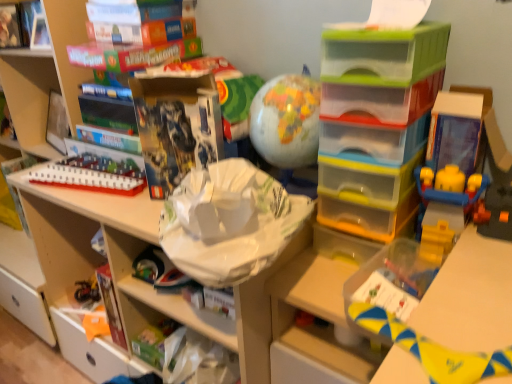
Locate an element on the screen. This screenshot has height=384, width=512. translucent plastic drawers at center, marked as the 2th shelf in a left-to-right arrangement is located at coordinates (375, 122).

This screenshot has width=512, height=384. Describe the element at coordinates (375, 122) in the screenshot. I see `translucent plastic drawers at center, which is the first shelf from right to left` at that location.

How much space does matte black book at upper center, marked as the 1th book in a right-to-left arrangement, occupy vertically?

matte black book at upper center, marked as the 1th book in a right-to-left arrangement, is 12.39 inches in height.

In order to face matte plastic globe at center, positioned as the third toy in bottom-to-top order, should I rotate leftwards or rightwards?

It's best to rotate right around 3.761 degrees.

This screenshot has width=512, height=384. I want to click on white plastic bookshelf at left, so click(x=44, y=80).

How many degrees apart are the facing directions of matte plastic globe at center, the first toy when ordered from top to bottom, and transparent plastic tray at left, which is the 5th book from right to left?

1.53 degrees.

From the image's perspective, which object appears higher, matte plastic globe at center, the second toy from the right, or transparent plastic tray at left, which is the 5th book from right to left?

matte plastic globe at center, the second toy from the right, appears higher in the image.

Which is more to the left, matte plastic globe at center, the 2th toy viewed from the back, or transparent plastic tray at left, which is the 5th book from right to left?

transparent plastic tray at left, which is the 5th book from right to left.

Considering their positions, is matte plastic globe at center, the 2th toy viewed from the back, located in front of or behind transparent plastic tray at left, which is counted as the 1th book, starting from the left?

Visually, matte plastic globe at center, the 2th toy viewed from the back, is located in front of transparent plastic tray at left, which is counted as the 1th book, starting from the left.

Are white plastic bookshelf at left and matte plastic globe at center, positioned as the third toy in bottom-to-top order, making contact?

There is a gap between white plastic bookshelf at left and matte plastic globe at center, positioned as the third toy in bottom-to-top order.

Does white plastic bookshelf at left come behind matte plastic globe at center, the first toy when ordered from top to bottom?

Yes.

Is white plastic bookshelf at left taller than matte plastic globe at center, arranged as the second toy when viewed from the left?

Indeed, white plastic bookshelf at left has a greater height compared to matte plastic globe at center, arranged as the second toy when viewed from the left.

Which is nearer, (30, 96) or (269, 100)?

Point (30, 96) appears to be farther away from the viewer than point (269, 100).

Considering the relative positions of matte plastic globe at center, the first toy when ordered from top to bottom, and white cardboard shelf at upper left, acting as the 2th shelf starting from the right, in the image provided, is matte plastic globe at center, the first toy when ordered from top to bottom, to the left or to the right of white cardboard shelf at upper left, acting as the 2th shelf starting from the right,?

matte plastic globe at center, the first toy when ordered from top to bottom, is positioned on white cardboard shelf at upper left, acting as the 2th shelf starting from the right,'s right side.

Is matte plastic globe at center, the first toy when ordered from top to bottom, spatially inside white cardboard shelf at upper left, acting as the 2th shelf starting from the right, or outside of it?

matte plastic globe at center, the first toy when ordered from top to bottom, is not inside white cardboard shelf at upper left, acting as the 2th shelf starting from the right, it's outside.

Is matte plastic globe at center, the second toy from the right, with white cardboard shelf at upper left, the 1th shelf in the left-to-right sequence?

No, matte plastic globe at center, the second toy from the right, is not beside white cardboard shelf at upper left, the 1th shelf in the left-to-right sequence.

Is white paper bag at upper center, which appears as the fourth book when viewed from the left, not within hardcover book at upper left, marked as the 4th book in a right-to-left arrangement?

Yes, white paper bag at upper center, which appears as the fourth book when viewed from the left, is outside of hardcover book at upper left, marked as the 4th book in a right-to-left arrangement.

Can you tell me how much white paper bag at upper center, the 2th book positioned from the right, and hardcover book at upper left, marked as the 4th book in a right-to-left arrangement, differ in facing direction?

The facing directions of white paper bag at upper center, the 2th book positioned from the right, and hardcover book at upper left, marked as the 4th book in a right-to-left arrangement, are 0.659 degrees apart.

Does white paper bag at upper center, which appears as the fourth book when viewed from the left, touch hardcover book at upper left, marked as the second book in a left-to-right arrangement?

white paper bag at upper center, which appears as the fourth book when viewed from the left, and hardcover book at upper left, marked as the second book in a left-to-right arrangement, are clearly separated.

Based on their sizes in the image, would you say white paper bag at upper center, the 2th book positioned from the right, is bigger or smaller than hardcover book at upper left, marked as the 4th book in a right-to-left arrangement?

Considering their sizes, white paper bag at upper center, the 2th book positioned from the right, takes up more space than hardcover book at upper left, marked as the 4th book in a right-to-left arrangement.

Which of these two, transparent plastic tray at left, which is the 5th book from right to left, or white cardboard shelf at upper left, acting as the 2th shelf starting from the right, is wider?

white cardboard shelf at upper left, acting as the 2th shelf starting from the right.

Considering their positions, is transparent plastic tray at left, which is the 5th book from right to left, located in front of or behind white cardboard shelf at upper left, acting as the 2th shelf starting from the right?

Clearly, transparent plastic tray at left, which is the 5th book from right to left, is behind white cardboard shelf at upper left, acting as the 2th shelf starting from the right.

How far apart are transparent plastic tray at left, which is the 5th book from right to left, and white cardboard shelf at upper left, acting as the 2th shelf starting from the right?

A distance of 28.72 inches exists between transparent plastic tray at left, which is the 5th book from right to left, and white cardboard shelf at upper left, acting as the 2th shelf starting from the right.

Is transparent plastic tray at left, which is counted as the 1th book, starting from the left, positioned with its back to white cardboard shelf at upper left, the 1th shelf in the left-to-right sequence?

No, transparent plastic tray at left, which is counted as the 1th book, starting from the left, is not facing away from white cardboard shelf at upper left, the 1th shelf in the left-to-right sequence.

How different are the orientations of matte cardboard book at upper left, the 3th book from the right, and white plastic bookshelf at left in degrees?

The angle between the facing direction of matte cardboard book at upper left, the 3th book from the right, and the facing direction of white plastic bookshelf at left is 0.845 degrees.

Considering the sizes of objects matte cardboard book at upper left, the 3th book from the right, and white plastic bookshelf at left in the image provided, who is smaller, matte cardboard book at upper left, the 3th book from the right, or white plastic bookshelf at left?

Smaller between the two is matte cardboard book at upper left, the 3th book from the right.

Is matte cardboard book at upper left, the 3th book from the right, further to camera compared to white plastic bookshelf at left?

Yes, matte cardboard book at upper left, the 3th book from the right, is further from the viewer.

Which of these two, matte cardboard book at upper left, placed as the 3th book when sorted from left to right, or white plastic bookshelf at left, stands taller?

Standing taller between the two is white plastic bookshelf at left.

From a real-world perspective, which object stands above the other?

From a 3D spatial view, matte black book at upper center, acting as the fifth book starting from the left, is above.

From the image's perspective, which one is positioned higher, white plastic train at upper left, which ranks as the third toy in right-to-left order, or matte black book at upper center, acting as the fifth book starting from the left?

matte black book at upper center, acting as the fifth book starting from the left, appears higher in the image.

In terms of height, does white plastic train at upper left, acting as the 1th toy starting from the left, look taller or shorter compared to matte black book at upper center, marked as the 1th book in a right-to-left arrangement?

Clearly, white plastic train at upper left, acting as the 1th toy starting from the left, is shorter compared to matte black book at upper center, marked as the 1th book in a right-to-left arrangement.

Locate an element on the screen. This screenshot has width=512, height=384. book that is the 5th one when counting backward from the matte plastic globe at center, arranged as the second toy when viewed from the left is located at coordinates (17, 165).

The image size is (512, 384). In the image, there is a matte plastic globe at center, positioned as the third toy in bottom-to-top order. Identify the location of bookshelf below it (from a real-world perspective). (44, 80).

From the image, which object appears to be nearer to matte black book at upper center, acting as the fifth book starting from the left, white cardboard shelf at upper left, the 1th shelf in the left-to-right sequence, or hardcover book at upper left, marked as the second book in a left-to-right arrangement?

Based on the image, white cardboard shelf at upper left, the 1th shelf in the left-to-right sequence, appears to be nearer to matte black book at upper center, acting as the fifth book starting from the left.

Looking at the image, which one is located further to yellow fabric toy at lower right, which is counted as the first toy, starting from the bottom, white plastic bookshelf at left or hardcover book at upper left, marked as the 4th book in a right-to-left arrangement?

Among the two, hardcover book at upper left, marked as the 4th book in a right-to-left arrangement, is located further to yellow fabric toy at lower right, which is counted as the first toy, starting from the bottom.

From the image, which object appears to be nearer to matte plastic globe at center, arranged as the second toy when viewed from the left, matte black book at upper center, marked as the 1th book in a right-to-left arrangement, or hardcover book at upper left, marked as the 4th book in a right-to-left arrangement?

matte black book at upper center, marked as the 1th book in a right-to-left arrangement.

Estimate the real-world distances between objects in this image. Which object is further from white cardboard shelf at upper left, acting as the 2th shelf starting from the right, transparent plastic tray at left, which is counted as the 1th book, starting from the left, or white paper bag at upper center, which appears as the fourth book when viewed from the left?

The object further to white cardboard shelf at upper left, acting as the 2th shelf starting from the right, is transparent plastic tray at left, which is counted as the 1th book, starting from the left.

From the picture: Based on their spatial positions, is matte plastic globe at center, the second toy from the right, or yellow fabric toy at lower right, the first toy viewed from the front, further from hardcover book at upper left, marked as the 4th book in a right-to-left arrangement?

Among the two, yellow fabric toy at lower right, the first toy viewed from the front, is located further to hardcover book at upper left, marked as the 4th book in a right-to-left arrangement.

Considering their positions, is white paper bag at upper center, which appears as the fourth book when viewed from the left, positioned further to white plastic train at upper left, which is counted as the 1th toy, starting from the back, than hardcover book at upper left, marked as the second book in a left-to-right arrangement?

hardcover book at upper left, marked as the second book in a left-to-right arrangement.

When comparing their distances from white cardboard shelf at upper left, acting as the 2th shelf starting from the right, does white plastic train at upper left, acting as the 1th toy starting from the left, or translucent plastic drawers at center, marked as the 2th shelf in a left-to-right arrangement, seem further?

translucent plastic drawers at center, marked as the 2th shelf in a left-to-right arrangement, is further to white cardboard shelf at upper left, acting as the 2th shelf starting from the right.

From the image, which object appears to be nearer to matte black book at upper center, marked as the 1th book in a right-to-left arrangement, white cardboard shelf at upper left, the 1th shelf in the left-to-right sequence, or white paper bag at upper center, which appears as the fourth book when viewed from the left?

white cardboard shelf at upper left, the 1th shelf in the left-to-right sequence, is positioned closer to the anchor matte black book at upper center, marked as the 1th book in a right-to-left arrangement.

This screenshot has height=384, width=512. I want to click on shelf between white plastic bookshelf at left and yellow fabric toy at lower right, the first toy viewed from the front, from left to right, so click(x=156, y=245).

Image resolution: width=512 pixels, height=384 pixels. Identify the location of shelf situated between transparent plastic tray at left, which is the 5th book from right to left, and translucent plastic drawers at center, marked as the 2th shelf in a left-to-right arrangement, from left to right. (156, 245).

Locate an element on the screen. This screenshot has height=384, width=512. shelf located between white plastic bookshelf at left and matte plastic globe at center, the 2th toy in the front-to-back sequence, in the left-right direction is located at coordinates (156, 245).

Find the location of a particular element. book between yellow fabric toy at lower right, the third toy positioned from the back, and white paper bag at upper center, the 2th book positioned from the right, from front to back is located at coordinates (176, 127).